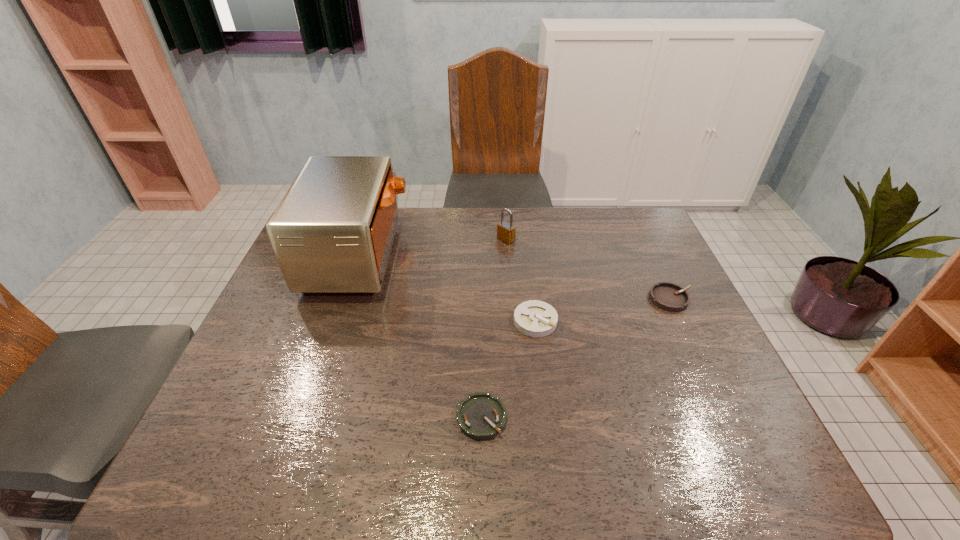
This screenshot has height=540, width=960. I want to click on vacant space that satisfies the following two spatial constraints: 1. on the door side of the rightmost object; 2. on the left side of the leftmost object, so pos(345,299).

Locate an element on the screen. Image resolution: width=960 pixels, height=540 pixels. free spot that satisfies the following two spatial constraints: 1. on the back side of the nearest object; 2. on the left side of the second ashtray from left to right is located at coordinates (481, 321).

Identify the location of free spot that satisfies the following two spatial constraints: 1. on the door side of the toaster oven; 2. on the right side of the rightmost ashtray. This screenshot has width=960, height=540. (345, 299).

Find the location of a particular element. The width and height of the screenshot is (960, 540). vacant space that satisfies the following two spatial constraints: 1. on the door side of the tallest object; 2. on the back side of the rightmost ashtray is located at coordinates (345, 299).

At what (x,y) coordinates should I click in order to perform the action: click on free spot that satisfies the following two spatial constraints: 1. on the back side of the nearest ashtray; 2. on the left side of the second tallest object. Please return your answer as a coordinate pair (x, y). Looking at the image, I should click on (481, 239).

Image resolution: width=960 pixels, height=540 pixels. What are the coordinates of `free space that satisfies the following two spatial constraints: 1. on the back side of the padlock; 2. on the left side of the nearest object` in the screenshot? It's located at click(481, 239).